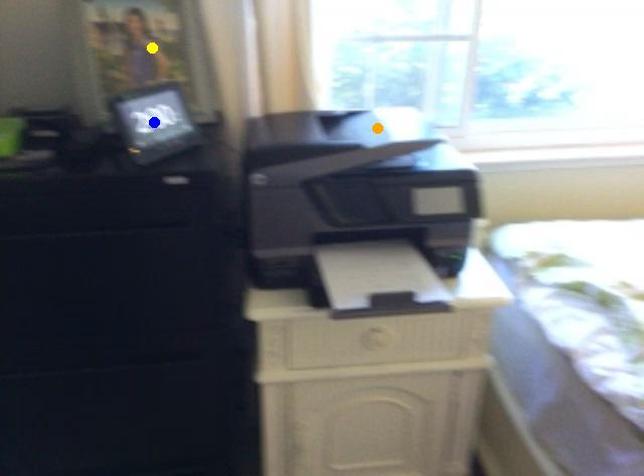
Order these from nearest to farthest:
A) blue point
B) yellow point
C) orange point

blue point < orange point < yellow point